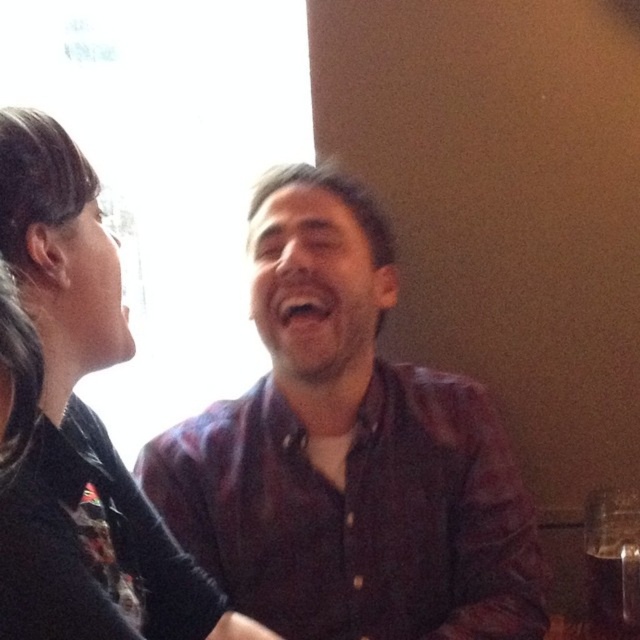
Question: Does dark brown shirt at center have a larger size compared to black leather jacket at upper left?

Choices:
 (A) yes
 (B) no

Answer: (A)

Question: Can you confirm if dark brown shirt at center is wider than black leather jacket at upper left?

Choices:
 (A) no
 (B) yes

Answer: (B)

Question: Among these objects, which one is farthest from the camera?

Choices:
 (A) dark brown shirt at center
 (B) black leather jacket at upper left

Answer: (A)

Question: Is dark brown shirt at center to the right of black leather jacket at upper left from the viewer's perspective?

Choices:
 (A) no
 (B) yes

Answer: (B)

Question: Which object is closer to the camera taking this photo?

Choices:
 (A) dark brown shirt at center
 (B) black leather jacket at upper left

Answer: (B)